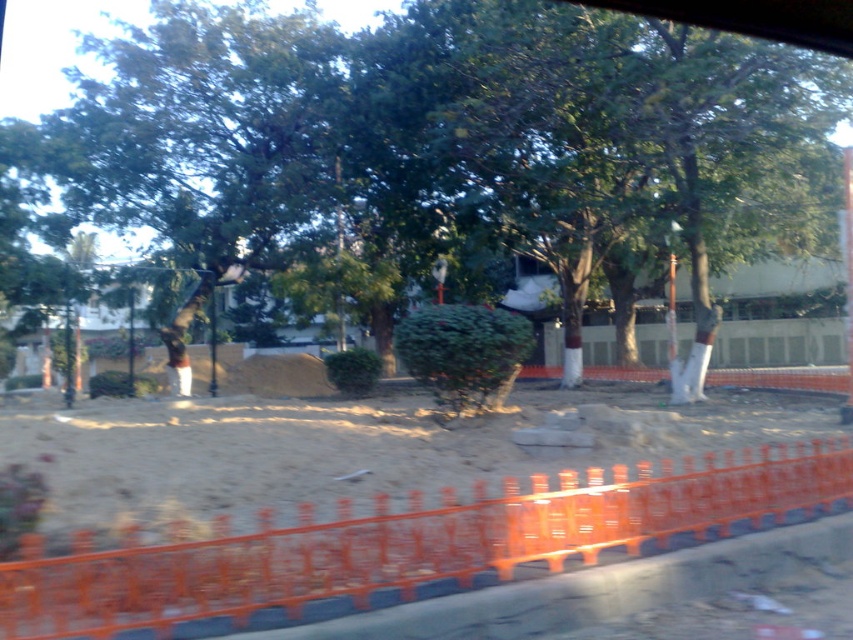
Is orange plastic barricade at lower center wider than brown fabric construction worker at center?

No, orange plastic barricade at lower center is not wider than brown fabric construction worker at center.

The width and height of the screenshot is (853, 640). What do you see at coordinates (412, 545) in the screenshot?
I see `orange plastic barricade at lower center` at bounding box center [412, 545].

Is point (306, 589) closer to viewer compared to point (177, 360)?

Yes, point (306, 589) is closer to viewer.

Find the location of `orange plastic barricade at lower center`. orange plastic barricade at lower center is located at coordinates point(412,545).

Identify the location of green leafy tree at center. The width and height of the screenshot is (853, 640). (775, 19).

Does green leafy tree at center have a smaller size compared to brown fabric construction worker at center?

Incorrect, green leafy tree at center is not smaller in size than brown fabric construction worker at center.

Describe the element at coordinates (775, 19) in the screenshot. The height and width of the screenshot is (640, 853). I see `green leafy tree at center` at that location.

Identify the location of green leafy tree at center. (775, 19).

Is orange plastic barricade at lower center shorter than green leafy tree at center?

Indeed, orange plastic barricade at lower center has a lesser height compared to green leafy tree at center.

Does orange plastic barricade at lower center have a larger size compared to green leafy tree at center?

No, orange plastic barricade at lower center is not bigger than green leafy tree at center.

At what (x,y) coordinates should I click in order to perform the action: click on orange plastic barricade at lower center. Please return your answer as a coordinate pair (x, y). The width and height of the screenshot is (853, 640). Looking at the image, I should click on (412, 545).